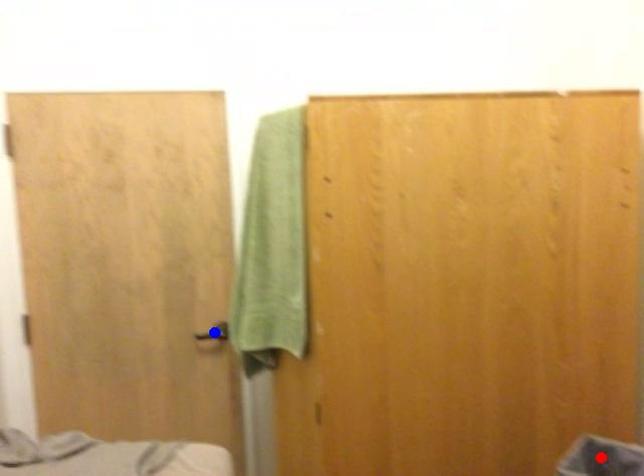
Question: Which of the two points in the image is closer to the camera?

Choices:
 (A) Blue point is closer.
 (B) Red point is closer.

Answer: (B)